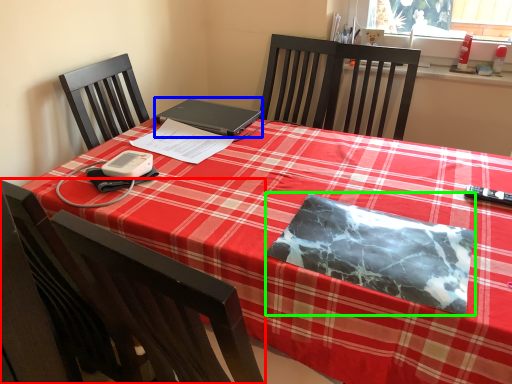
Question: Which object is positioned closest to chair (highlighted by a red box)? Select from laptop (highlighted by a blue box) and notebook (highlighted by a green box).

Choices:
 (A) laptop
 (B) notebook

Answer: (B)